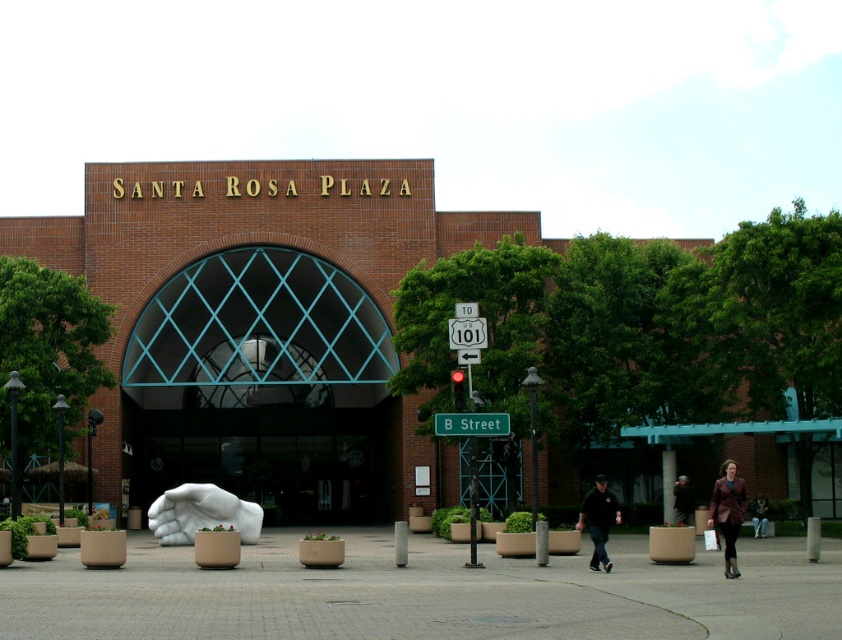
You are standing at the entrance of Santa Rosa Plaza and want to walk towards the point labeled as point (606,557). However, there is an obstacle at point labeled as point (771,609). Will you encounter the obstacle before reaching your destination?

Yes, you will encounter the obstacle at point (771,609) before reaching your destination at point (606,557) because point (771,609) is in front of point (606,557).

You are standing at the entrance of Santa Rosa Plaza and see the white marble hand at center and the brown leather jacket at lower right. Which object is closer to the left side of the plaza?

The white marble hand at center is closer to the left side of the plaza because it is positioned to the left of the brown leather jacket at lower right.